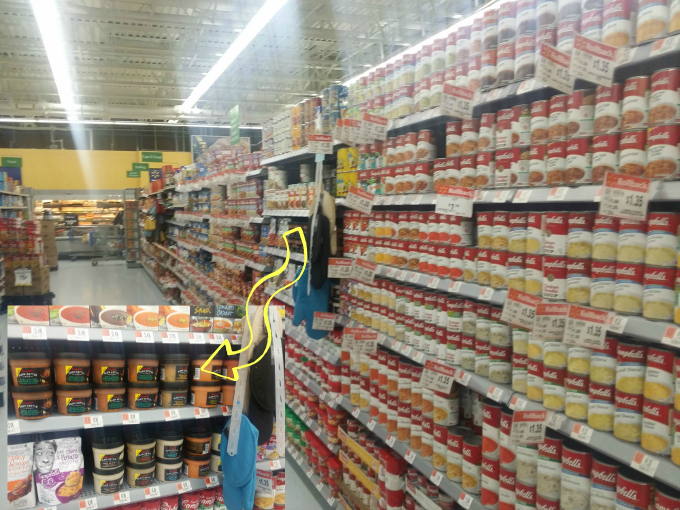
Where is `oven mitts`? Image resolution: width=680 pixels, height=510 pixels. oven mitts is located at coordinates (313, 258).